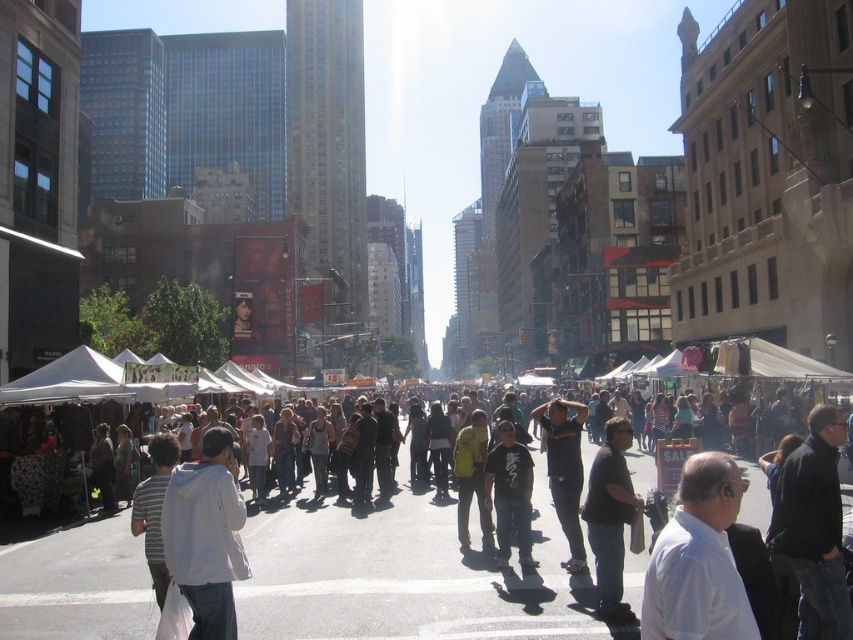
You are standing at the point marked by the coordinate 0.5, 0.5 in the image. Looking towards the black cotton shirt at center right represented by point (611, 518), which direction should you walk to reach it? Please answer with either north, south, east, or west.

east

You are a photographer trying to capture a candid shot of the crowd at the urban street market. You notice the white shirt at lower right and the dark gray pants at center. Which of these two items should you focus on if you want to photograph the smaller one?

The white shirt at lower right has a smaller size compared to the dark gray pants at center, so you should focus on the white shirt at lower right.